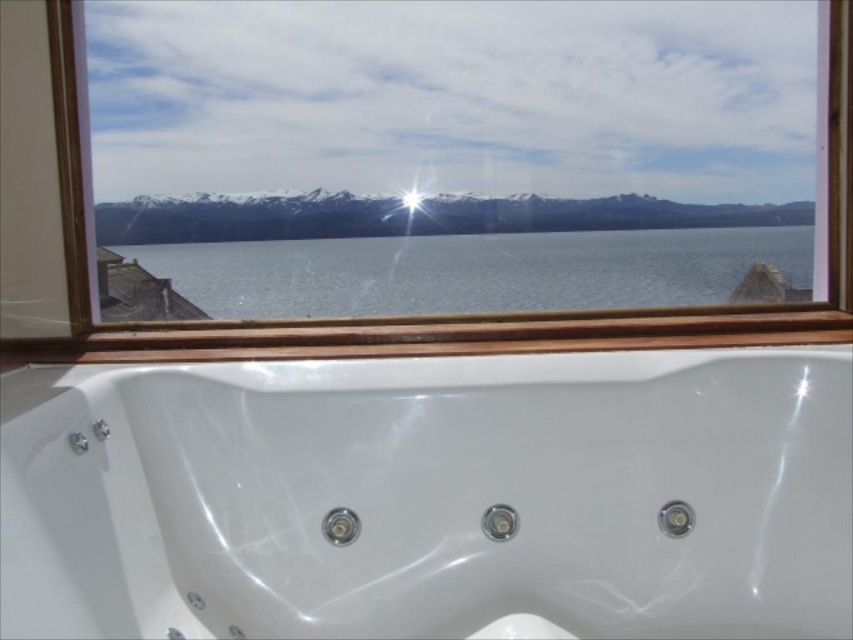
Consider the image. You are a home inspector assessing the bathroom layout. You need to determine if the white glossy bathtub at center and the wooden frame at upper center are aligned properly. Based on their positions, which object is located to the right of the other?

The white glossy bathtub at center is positioned on the right side of the wooden frame at upper center, so the bathtub is to the right of the wooden frame.

You are a window cleaner standing in front of the white glossy bathtub at center. You need to clean the wooden frame at upper center but want to avoid getting water on the bathtub. Which object should you clean first?

You should clean the wooden frame at upper center first because it is behind the white glossy bathtub at center. Cleaning the frame first while the bathtub is dry will prevent water from dripping onto it when you clean the frame afterward.